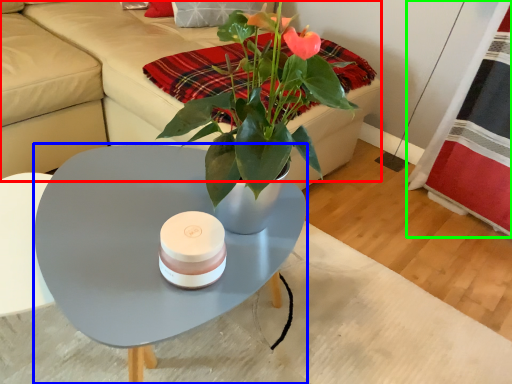
Question: Considering the real-world distances, which object is farthest from couch (highlighted by a red box)? coffee table (highlighted by a blue box) or plaid (highlighted by a green box)?

Choices:
 (A) coffee table
 (B) plaid

Answer: (B)